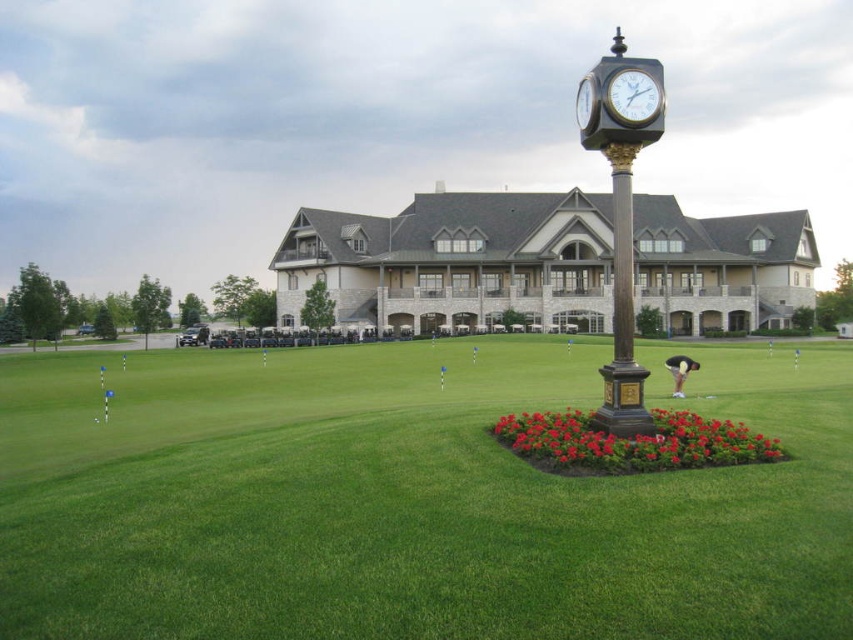
You are standing at the point labeled as point (410, 499) on the golf course. What is the name of the object you are currently standing on?

The green grass at center is located at point (410, 499), so you are standing on the green grass at center.

You are standing on the golf course and want to walk from point (84, 465) to point (595, 432). Which direction should you face to move towards the latter?

You should face away from the clock tower because point (84, 465) is closer to you than point (595, 432), meaning the latter is further away and likely behind the clock tower.